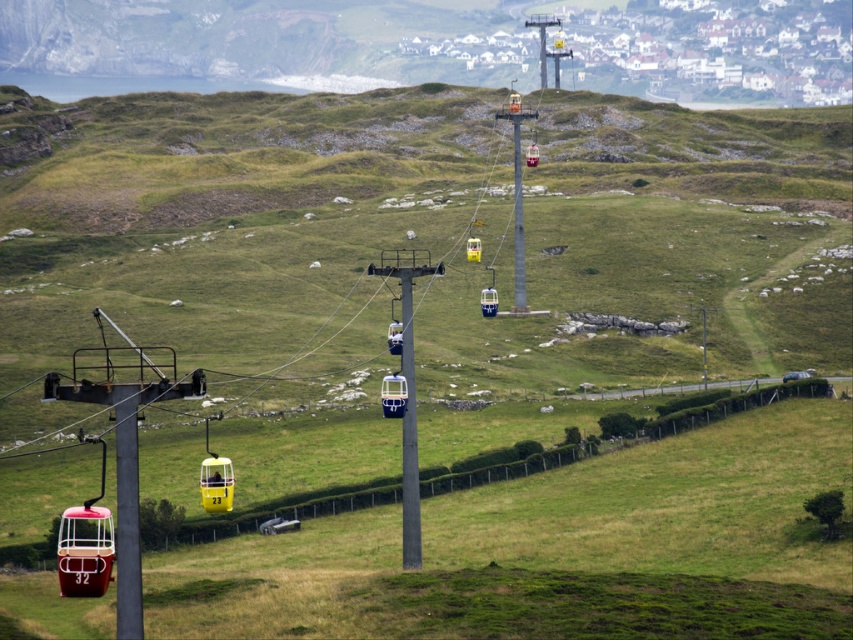
Question: Does metallic cable car at center appear on the left side of yellow plastic gondola at center?

Choices:
 (A) no
 (B) yes

Answer: (B)

Question: Is metallic gray cable car pole at center to the right of yellow plastic gondola at center from the viewer's perspective?

Choices:
 (A) no
 (B) yes

Answer: (B)

Question: Which point is farther to the camera?

Choices:
 (A) yellow plastic gondola at center
 (B) metallic cable car at center
 (C) metallic cable car pole at left

Answer: (A)

Question: Which point is farther from the camera taking this photo?

Choices:
 (A) click(x=520, y=216)
 (B) click(x=405, y=532)
 (C) click(x=480, y=243)
 (D) click(x=123, y=397)

Answer: (A)

Question: Can you confirm if metallic cable car at center is thinner than metallic gray cable car pole at center?

Choices:
 (A) yes
 (B) no

Answer: (A)

Question: Which point is closer to the camera?

Choices:
 (A) metallic cable car pole at left
 (B) metallic gray cable car pole at center
 (C) metallic cable car at center

Answer: (A)